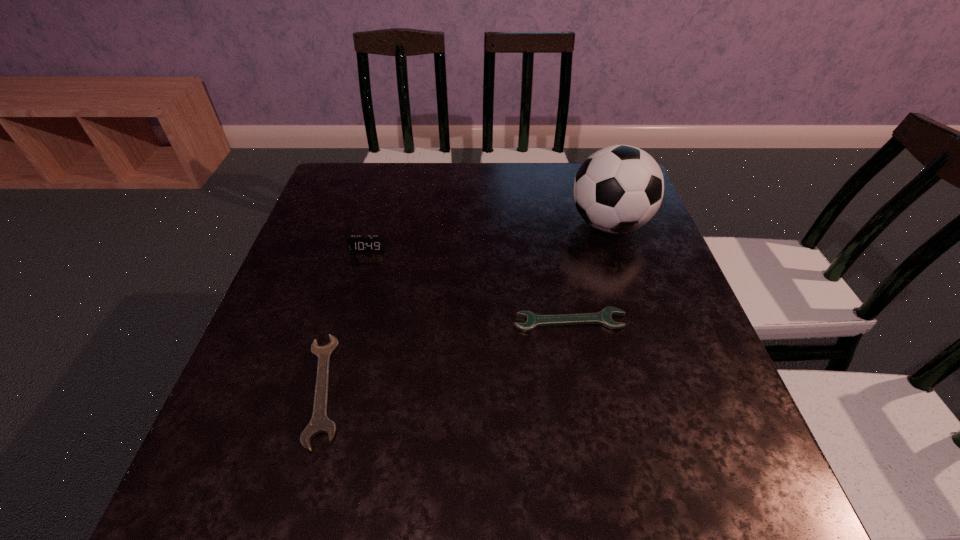
Identify the location of free spot between the third shortest object and the right wrench. (468, 285).

Image resolution: width=960 pixels, height=540 pixels. In order to click on free space that is in between the second nearest object and the alarm clock in this screenshot , I will do `click(468, 285)`.

Locate an element on the screen. The image size is (960, 540). vacant area that lies between the right wrench and the tallest object is located at coordinates (589, 272).

Identify the location of free spot between the tallest object and the nearest object. Image resolution: width=960 pixels, height=540 pixels. (466, 306).

Identify the location of free point between the third shortest object and the farther wrench. The width and height of the screenshot is (960, 540). (468, 285).

The image size is (960, 540). What are the coordinates of `unoccupied area between the farther wrench and the nearer wrench` in the screenshot? It's located at (446, 355).

The height and width of the screenshot is (540, 960). What are the coordinates of `vacant space that's between the right wrench and the soccer ball` in the screenshot? It's located at (589, 272).

Find the location of `free space between the right wrench and the third shortest object`. free space between the right wrench and the third shortest object is located at coordinates (468, 285).

You are a GUI agent. You are given a task and a screenshot of the screen. Output one action in this format:
    pyautogui.click(x=<x>, y=<y>)
    Task: Click on the empty location between the right wrench and the tallest object
    This screenshot has height=540, width=960.
    Given the screenshot: What is the action you would take?
    pyautogui.click(x=589, y=272)

This screenshot has width=960, height=540. What are the coordinates of `vacant region between the right wrench and the soccer ball` in the screenshot? It's located at (589, 272).